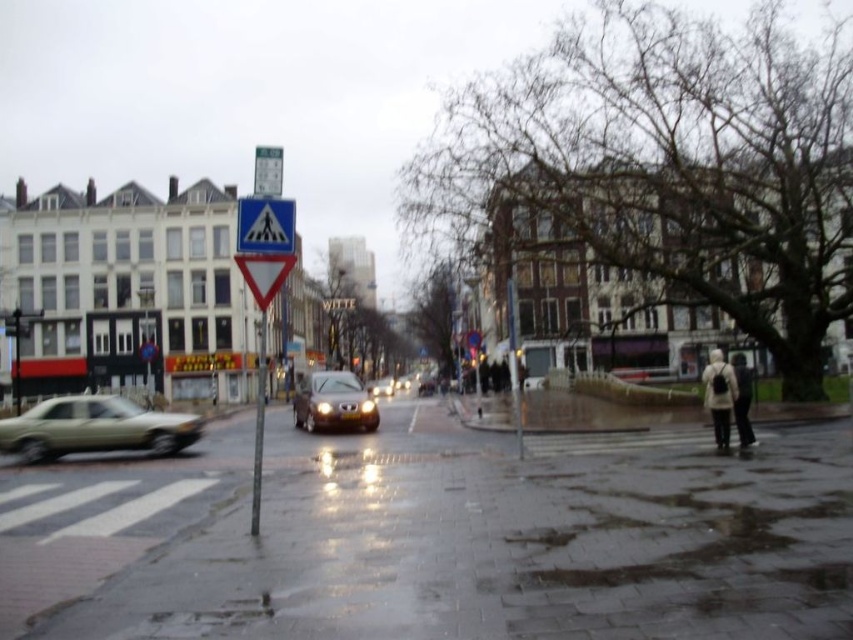
Question: Can you confirm if wet concrete pavement at lower center is smaller than blue plastic pedestrian crossing sign at left?

Choices:
 (A) no
 (B) yes

Answer: (B)

Question: Is dark brown leather coat at lower right positioned before white plastic speed limit sign at upper center?

Choices:
 (A) yes
 (B) no

Answer: (B)

Question: Where is metallic gold sedan at left located in relation to shiny brown car at center in the image?

Choices:
 (A) below
 (B) above

Answer: (B)

Question: Considering the real-world distances, which object is farthest from the blue plastic pedestrian crossing sign at left?

Choices:
 (A) white plastic pedestrian crossing sign at upper center
 (B) metallic reflective yield sign at center
 (C) metallic gold sedan at left

Answer: (B)

Question: Which of these objects is positioned closest to the white plastic pedestrian crossing sign at upper center?

Choices:
 (A) blue plastic pedestrian crossing sign at left
 (B) metallic reflective yield sign at center
 (C) white plastic speed limit sign at upper center
 (D) dark brown leather coat at lower right

Answer: (B)

Question: Based on their relative distances, which object is farther from the shiny brown car at center?

Choices:
 (A) white plastic speed limit sign at upper center
 (B) wet concrete pavement at lower center

Answer: (A)